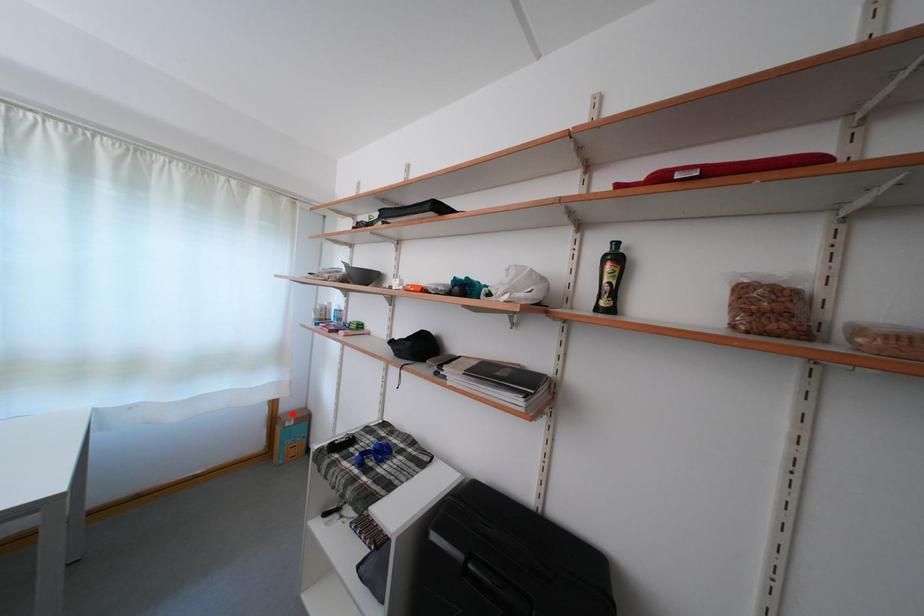
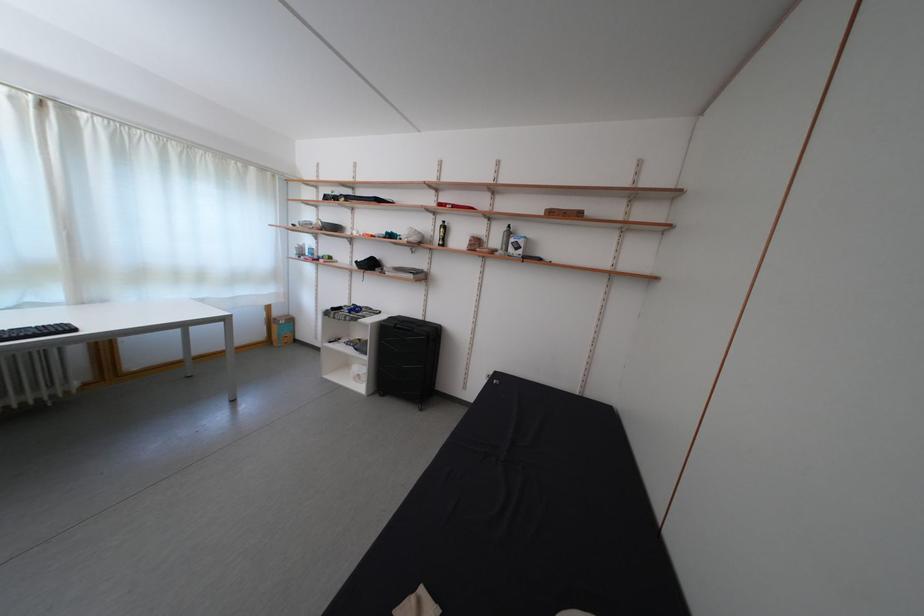
Question: I am providing you with two images of the same scene from different viewpoints. In image1, a red point is highlighted. Considering the same 3D point in image2, which of the following is correct?

Choices:
 (A) It is closer
 (B) It is farther

Answer: (B)